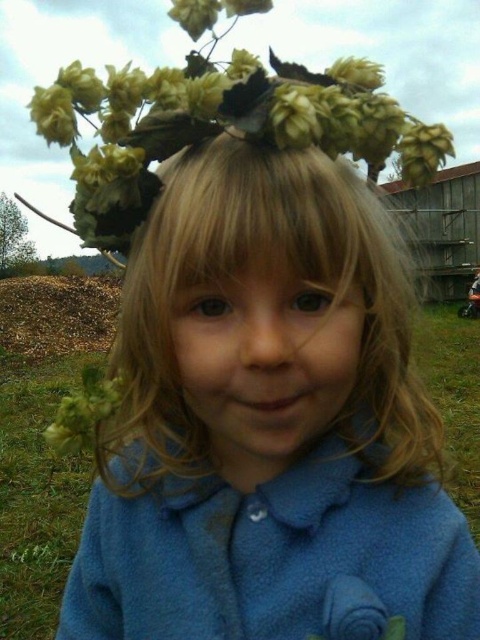
You are a photographer setting up a shot of the child. The blue fleece head at center and the green matte flower at upper center are in your frame. Which object is positioned higher in the image?

The green matte flower at upper center is positioned higher in the image than the blue fleece head at center.

You are a fashion designer observing the child in the image. You need to decide whether the blue fleece jacket at center can be seen above the green matte flower at upper center when the child is wearing both. Based on their sizes, what do you think?

The blue fleece jacket at center is not as tall as the green matte flower at upper center, so the jacket will not be visible above the flower.

You are a photographer taking a picture of the child with the floral crown. You notice two points marked in the scene. Which point is closer to your camera lens, point 1 at coordinates point (213, 531) or point 2 at coordinates point (375, 317)?

Point 1 at coordinates point (213, 531) is closer to the camera lens because it is further to the camera than point 2 at coordinates point (375, 317).